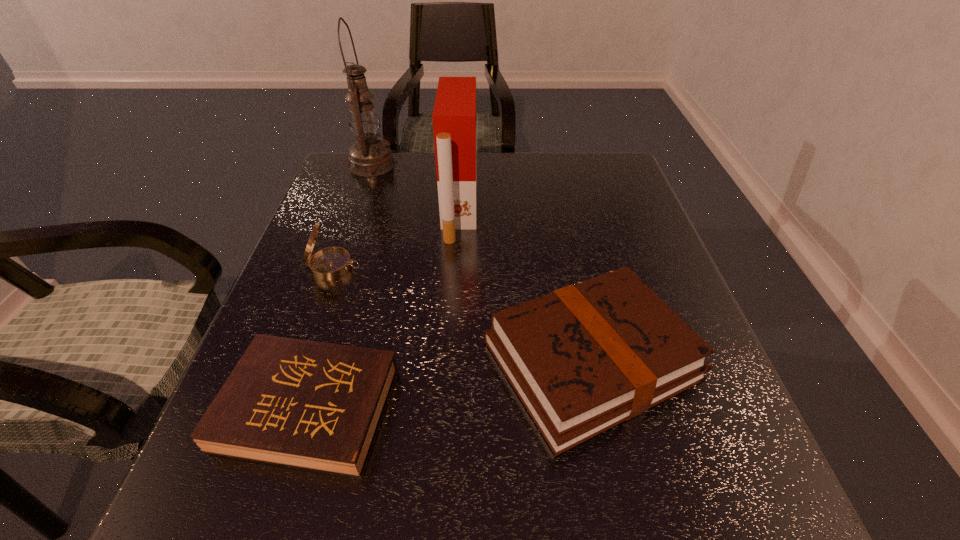
Find the location of a particular element. The width and height of the screenshot is (960, 540). the farthest object is located at coordinates (369, 156).

Where is `the tallest object`? Image resolution: width=960 pixels, height=540 pixels. the tallest object is located at coordinates (369, 156).

Find the location of a particular element. This screenshot has height=540, width=960. cigarette case is located at coordinates (454, 115).

Locate an element on the screen. the fourth nearest object is located at coordinates (454, 115).

I want to click on the third nearest object, so click(x=330, y=263).

I want to click on compass, so click(x=330, y=263).

Locate an element on the screen. the right hardback book is located at coordinates (584, 358).

You are a GUI agent. You are given a task and a screenshot of the screen. Output one action in this format:
    pyautogui.click(x=<x>, y=<y>)
    Task: Click on the rightmost object
    This screenshot has width=960, height=540.
    Given the screenshot: What is the action you would take?
    pyautogui.click(x=584, y=358)

Where is `the left hardback book`? the left hardback book is located at coordinates (312, 405).

The height and width of the screenshot is (540, 960). Identify the location of the shortest object. (312, 405).